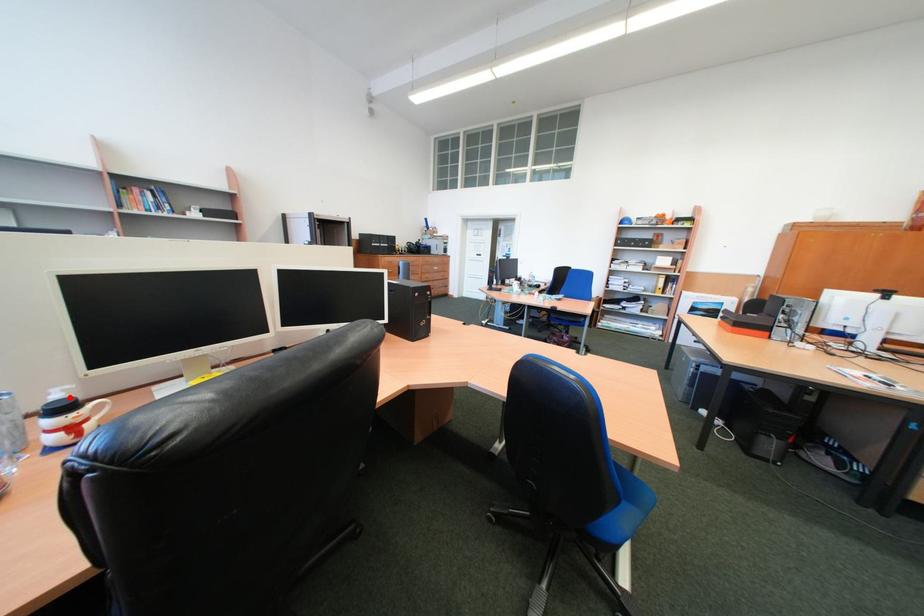
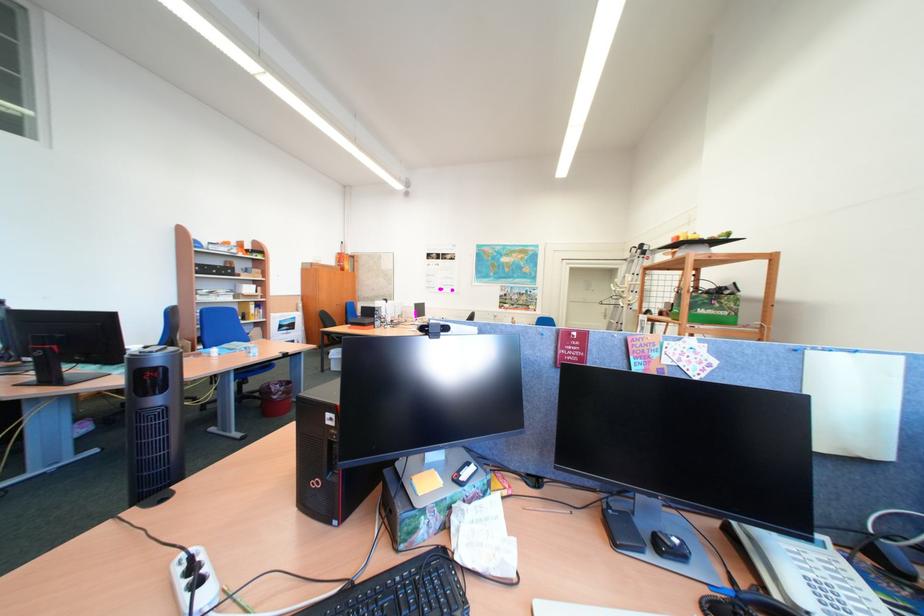
Question: I am providing you with two images of the same scene from different viewpoints. A red point is marked on the first image. At the location where the point appears in image 1, is it still visible in image 2?

Choices:
 (A) Yes
 (B) No

Answer: (B)